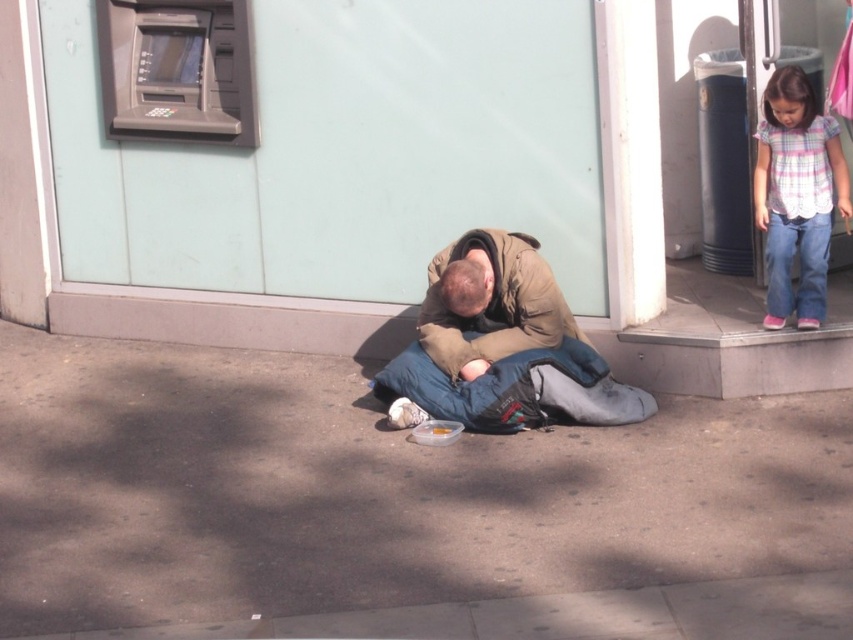
Can you confirm if brown concrete pavement at center is positioned above pink plaid shirt at upper right?

Actually, brown concrete pavement at center is below pink plaid shirt at upper right.

Consider the image. Is brown concrete pavement at center to the left of pink plaid shirt at upper right from the viewer's perspective?

Correct, you'll find brown concrete pavement at center to the left of pink plaid shirt at upper right.

In order to click on brown concrete pavement at center in this screenshot , I will do `click(370, 492)`.

Who is taller, brown concrete pavement at center or blue fabric sleeping bag at center?

Standing taller between the two is brown concrete pavement at center.

Can you confirm if brown concrete pavement at center is smaller than blue fabric sleeping bag at center?

Incorrect, brown concrete pavement at center is not smaller in size than blue fabric sleeping bag at center.

Who is more forward, (274,499) or (646,408)?

Point (274,499)

Identify the location of brown concrete pavement at center. point(370,492).

Does pink plaid shirt at upper right have a smaller size compared to blue fabric sleeping bag at center?

Indeed, pink plaid shirt at upper right has a smaller size compared to blue fabric sleeping bag at center.

Does point (764, 118) come in front of point (410, 424)?

No.

I want to click on pink plaid shirt at upper right, so click(x=796, y=195).